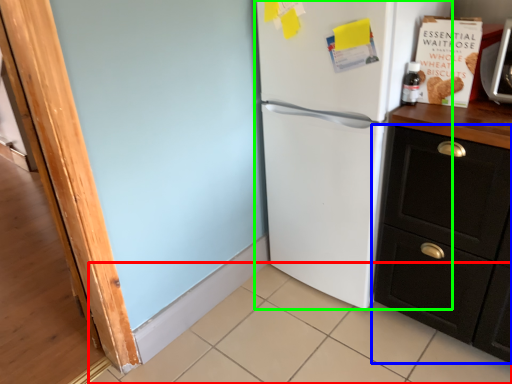
Question: Considering the real-world distances, which object is farthest from tile (highlighted by a red box)? cabinetry (highlighted by a blue box) or refrigerator (highlighted by a green box)?

Choices:
 (A) cabinetry
 (B) refrigerator

Answer: (B)